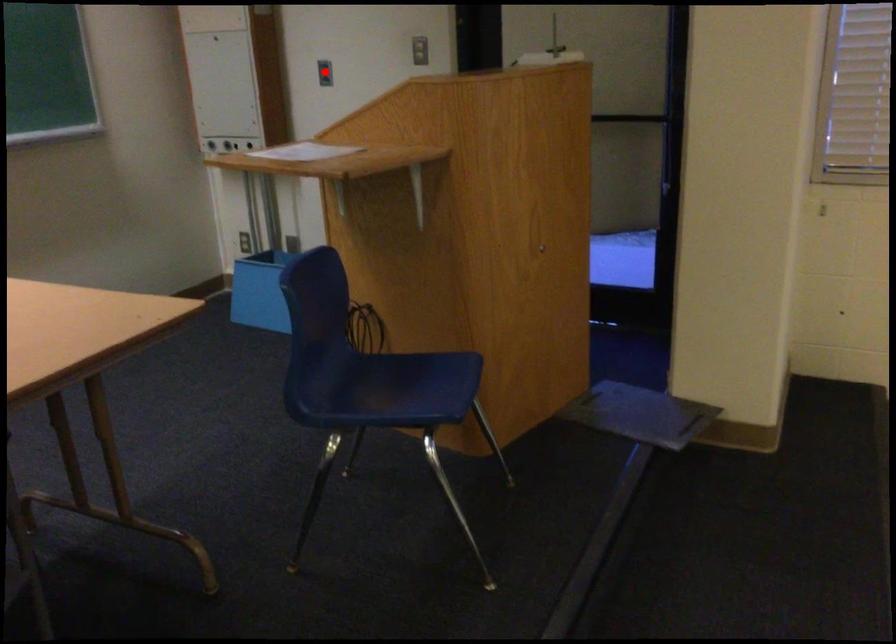
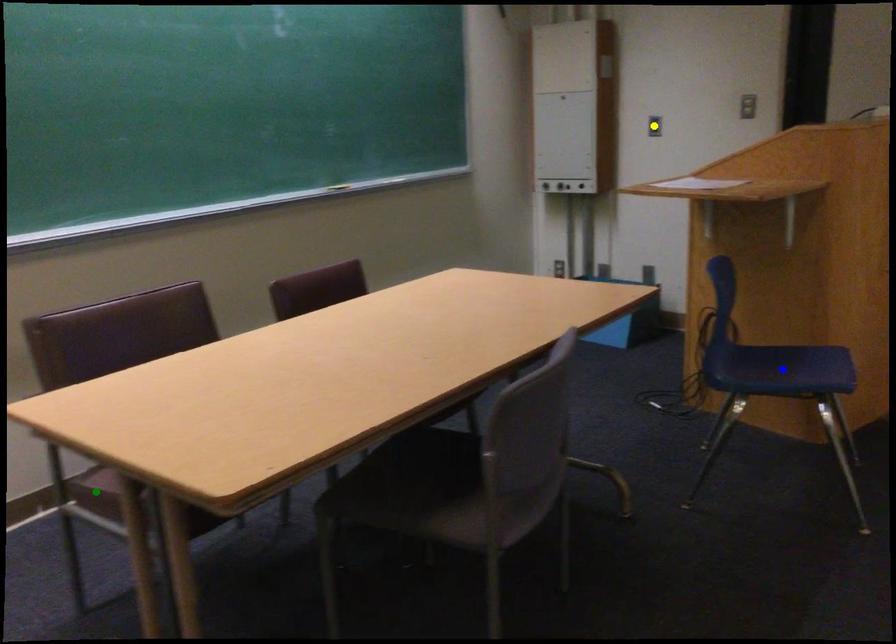
Question: I am providing you with two images of the same scene from different viewpoints. A red point is marked on the first image. You are given multiple points on the second image. Which mark in image 2 goes with the point in image 1?

Choices:
 (A) yellow point
 (B) blue point
 (C) green point

Answer: (A)